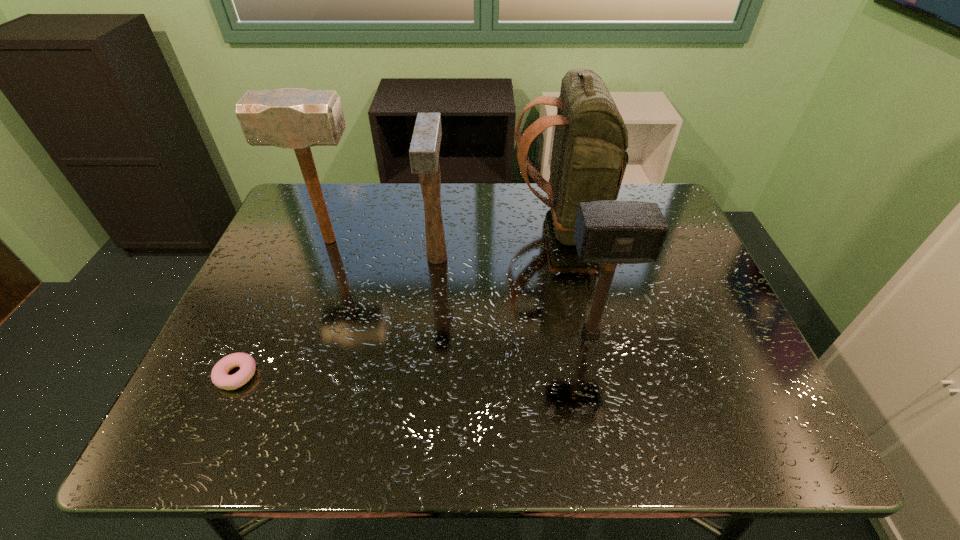
Where is `vacant space in between the nearest mallet and the leftmost mallet`? The height and width of the screenshot is (540, 960). vacant space in between the nearest mallet and the leftmost mallet is located at coordinates (460, 287).

The width and height of the screenshot is (960, 540). Find the location of `empty space between the second mallet from right to left and the backpack`. empty space between the second mallet from right to left and the backpack is located at coordinates (500, 241).

Where is `vacant point located between the leftmost mallet and the backpack`? Image resolution: width=960 pixels, height=540 pixels. vacant point located between the leftmost mallet and the backpack is located at coordinates (446, 233).

Locate an element on the screen. This screenshot has width=960, height=540. empty location between the second mallet from left to right and the rightmost mallet is located at coordinates (514, 296).

The width and height of the screenshot is (960, 540). Identify the location of vacant space that is in between the nearest mallet and the backpack. (577, 279).

Choose which object is the third nearest neighbor to the fourth farthest object. Please provide its 2D coordinates. Your answer should be formatted as a tuple, i.e. [(x, y)], where the tuple contains the x and y coordinates of a point satisfying the conditions above.

[(290, 118)]

What are the coordinates of `object that stands as the closest to the rightmost mallet` in the screenshot? It's located at (589, 157).

Identify which mallet is the second closest to the backpack. Please provide its 2D coordinates. Your answer should be formatted as a tuple, i.e. [(x, y)], where the tuple contains the x and y coordinates of a point satisfying the conditions above.

[(609, 232)]

Identify which mallet is the second closest to the second nearest object. Please provide its 2D coordinates. Your answer should be formatted as a tuple, i.e. [(x, y)], where the tuple contains the x and y coordinates of a point satisfying the conditions above.

[(290, 118)]

Image resolution: width=960 pixels, height=540 pixels. I want to click on vacant region that satisfies the following two spatial constraints: 1. on the striking face of the leftmost mallet; 2. on the back side of the third object from left to right, so click(x=324, y=258).